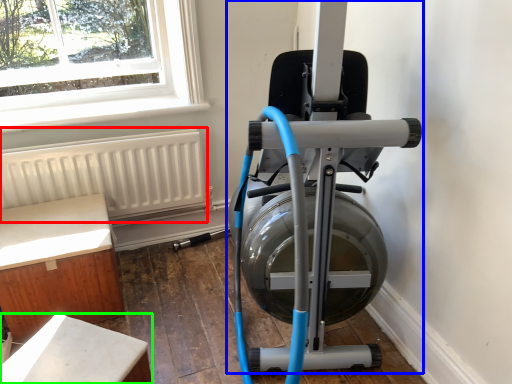
Question: Estimate the real-world distances between objects in this image. Which object is farther from radiator (highlighted by a red box), stationary bicycle (highlighted by a blue box) or furniture (highlighted by a green box)?

Choices:
 (A) stationary bicycle
 (B) furniture

Answer: (B)